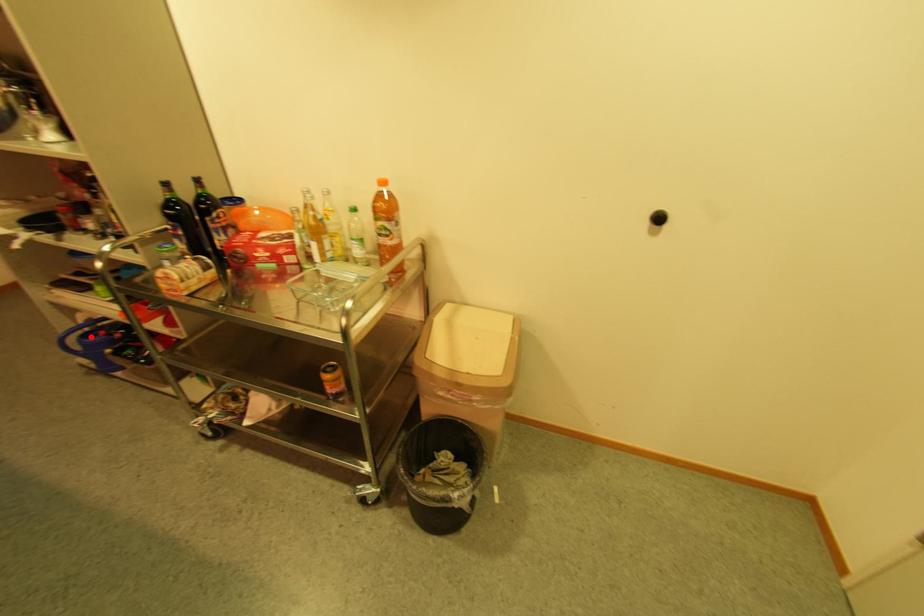
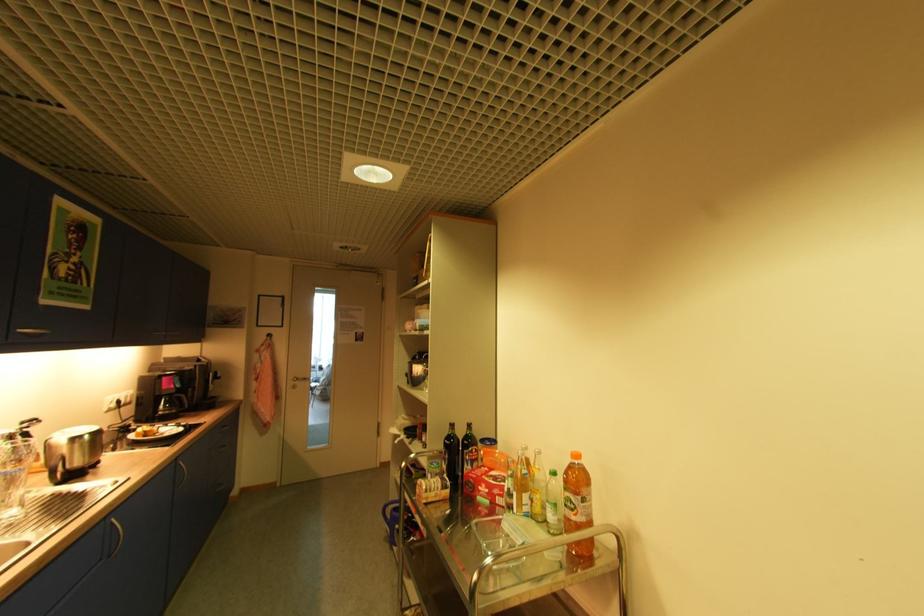
In the second image, find the point that corresponds to the highlighted location in the first image.

(400, 509)